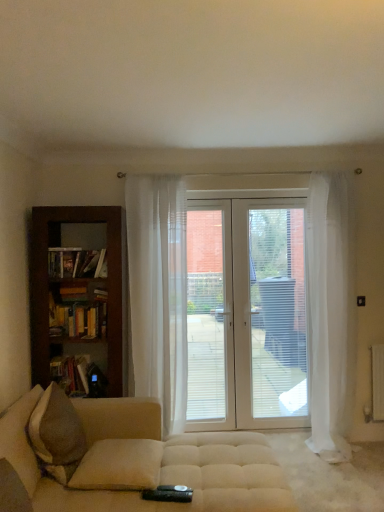
What do you see at coordinates (119, 465) in the screenshot?
I see `beige fabric pillow at lower center, the 2th pillow in the left-to-right sequence` at bounding box center [119, 465].

You are a GUI agent. You are given a task and a screenshot of the screen. Output one action in this format:
    pyautogui.click(x=<x>, y=<y>)
    Task: Click on the beige fabric pillow at lower left, which is the 1th pillow in front-to-back order
    The width and height of the screenshot is (384, 512).
    Given the screenshot: What is the action you would take?
    pyautogui.click(x=20, y=439)

This screenshot has height=512, width=384. What do you see at coordinates (158, 292) in the screenshot?
I see `sheer white curtain at center, the 2th curtain in the right-to-left sequence` at bounding box center [158, 292].

Describe the element at coordinates (78, 319) in the screenshot. I see `wooden bookshelf at left, acting as the second book starting from the bottom` at that location.

Image resolution: width=384 pixels, height=512 pixels. What are the coordinates of `white sheer curtain at right, positioned as the 1th curtain in right-to-left order` in the screenshot? It's located at click(x=330, y=313).

You are a GUI agent. You are given a task and a screenshot of the screen. Output one action in this format:
    pyautogui.click(x=<x>, y=<y>)
    Task: Click on the beige fabric studio couch at lower left
    
    Given the screenshot: What is the action you would take?
    pyautogui.click(x=137, y=463)

Find the location of a particular element. The height and width of the screenshot is (512, 384). beige fabric pillow at lower center, which is the 2th pillow from front to back is located at coordinates (119, 465).

Which object is wider, beige fabric studio couch at lower left or sheer white curtain at center, the 2th curtain in the right-to-left sequence?

beige fabric studio couch at lower left.

From the image's perspective, is beige fabric studio couch at lower left above or below sheer white curtain at center, which appears as the 1th curtain when viewed from the left?

beige fabric studio couch at lower left is below sheer white curtain at center, which appears as the 1th curtain when viewed from the left.

Are white sheer curtain at right, which appears as the 2th curtain when viewed from the left, and beige fabric studio couch at lower left far apart?

Yes, white sheer curtain at right, which appears as the 2th curtain when viewed from the left, is far from beige fabric studio couch at lower left.

Considering the positions of objects white sheer curtain at right, which appears as the 2th curtain when viewed from the left, and beige fabric studio couch at lower left in the image provided, who is in front, white sheer curtain at right, which appears as the 2th curtain when viewed from the left, or beige fabric studio couch at lower left?

beige fabric studio couch at lower left is closer to the camera.

From a real-world perspective, is white sheer curtain at right, which appears as the 2th curtain when viewed from the left, above or below beige fabric studio couch at lower left?

From a real-world perspective, white sheer curtain at right, which appears as the 2th curtain when viewed from the left, is physically above beige fabric studio couch at lower left.

Is the surface of beige fabric pillow at lower left, the 1th pillow from the left, in direct contact with wooden bookshelf at left, the 1th book viewed from the top?

No, beige fabric pillow at lower left, the 1th pillow from the left, is not with wooden bookshelf at left, the 1th book viewed from the top.

Which is behind, beige fabric pillow at lower left, which is the 1th pillow in front-to-back order, or wooden bookshelf at left, acting as the second book starting from the bottom?

wooden bookshelf at left, acting as the second book starting from the bottom.

Is beige fabric pillow at lower left, the 1th pillow from the left, shorter than wooden bookshelf at left, the 1th book viewed from the top?

In fact, beige fabric pillow at lower left, the 1th pillow from the left, may be taller than wooden bookshelf at left, the 1th book viewed from the top.

Which of these two, beige fabric pillow at lower left, the 2th pillow from the back, or wooden bookshelf at left, the 1th book viewed from the top, is thinner?

With smaller width is wooden bookshelf at left, the 1th book viewed from the top.

Is beige fabric pillow at lower left, the 2th pillow from the back, outside of beige fabric studio couch at lower left?

Absolutely, beige fabric pillow at lower left, the 2th pillow from the back, is external to beige fabric studio couch at lower left.

Based on the photo, is beige fabric pillow at lower left, the 1th pillow from the left, at the left side of beige fabric studio couch at lower left?

Yes, beige fabric pillow at lower left, the 1th pillow from the left, is to the left of beige fabric studio couch at lower left.

Which is behind, point (60, 213) or point (118, 484)?

Positioned behind is point (60, 213).

Is dark wood bookcase at left in contact with beige fabric pillow at lower center, arranged as the 1th pillow when viewed from the back?

No.

Considering the positions of objects dark wood bookcase at left and beige fabric pillow at lower center, the 2th pillow in the left-to-right sequence, in the image provided, who is more to the right, dark wood bookcase at left or beige fabric pillow at lower center, the 2th pillow in the left-to-right sequence,?

beige fabric pillow at lower center, the 2th pillow in the left-to-right sequence.

In terms of width, does dark wood bookcase at left look wider or thinner when compared to beige fabric pillow at lower center, which is the 1th pillow from right to left?

dark wood bookcase at left is thinner than beige fabric pillow at lower center, which is the 1th pillow from right to left.

How far apart are white glossy door at center and beige fabric pillow at lower left, which is the 1th pillow in front-to-back order?

They are 1.85 meters apart.

Considering the sizes of objects white glossy door at center and beige fabric pillow at lower left, which is the 1th pillow in front-to-back order, in the image provided, who is thinner, white glossy door at center or beige fabric pillow at lower left, which is the 1th pillow in front-to-back order,?

white glossy door at center.

Considering the sizes of objects white glossy door at center and beige fabric pillow at lower left, the second pillow positioned from the right, in the image provided, who is shorter, white glossy door at center or beige fabric pillow at lower left, the second pillow positioned from the right,?

With less height is beige fabric pillow at lower left, the second pillow positioned from the right.

From the image's perspective, is white glossy door at center positioned above or below beige fabric pillow at lower left, the 1th pillow from the left?

white glossy door at center is situated higher than beige fabric pillow at lower left, the 1th pillow from the left, in the image.

Who is smaller, beige fabric studio couch at lower left or hardcover book at left, the second book positioned from the top?

hardcover book at left, the second book positioned from the top, is smaller.

Measure the distance from beige fabric studio couch at lower left to hardcover book at left, the second book positioned from the top.

88.33 centimeters.

Between beige fabric studio couch at lower left and hardcover book at left, the second book positioned from the top, which one is positioned behind?

hardcover book at left, the second book positioned from the top, is further from the camera.

Considering the sizes of beige fabric studio couch at lower left and hardcover book at left, the second book positioned from the top, in the image, is beige fabric studio couch at lower left wider or thinner than hardcover book at left, the second book positioned from the top,?

Considering their sizes, beige fabric studio couch at lower left looks broader than hardcover book at left, the second book positioned from the top.

You are a GUI agent. You are given a task and a screenshot of the screen. Output one action in this format:
    pyautogui.click(x=<x>, y=<y>)
    Task: Click on the 2nd curtain behind the beige fabric studio couch at lower left
    
    Given the screenshot: What is the action you would take?
    coord(158,292)

This screenshot has width=384, height=512. I want to click on the 1st curtain above the beige fabric studio couch at lower left (from a real-world perspective), so click(330, 313).

Which object lies further to the anchor point beige fabric pillow at lower left, which is the 1th pillow in front-to-back order, hardcover book at left, the second book positioned from the top, or beige fabric studio couch at lower left?

Based on the image, hardcover book at left, the second book positioned from the top, appears to be further to beige fabric pillow at lower left, which is the 1th pillow in front-to-back order.

Looking at this image, estimate the real-world distances between objects in this image. Which object is closer to beige fabric studio couch at lower left, beige fabric pillow at lower left, the 1th pillow from the left, or white glossy door at center?

Based on the image, beige fabric pillow at lower left, the 1th pillow from the left, appears to be nearer to beige fabric studio couch at lower left.

From the picture: Which object lies nearer to the anchor point hardcover book at left, the second book positioned from the top, beige fabric studio couch at lower left or beige fabric pillow at lower left, the 2th pillow from the back?

beige fabric pillow at lower left, the 2th pillow from the back, is positioned closer to the anchor hardcover book at left, the second book positioned from the top.

When comparing their distances from beige fabric pillow at lower center, the 2th pillow in the left-to-right sequence, does white sheer curtain at right, which appears as the 2th curtain when viewed from the left, or hardcover book at left, the second book positioned from the top, seem closer?

hardcover book at left, the second book positioned from the top, lies closer to beige fabric pillow at lower center, the 2th pillow in the left-to-right sequence, than the other object.

Estimate the real-world distances between objects in this image. Which object is closer to white glossy door at center, dark wood bookcase at left or beige fabric studio couch at lower left?

Based on the image, dark wood bookcase at left appears to be nearer to white glossy door at center.

Based on the photo, considering their positions, is beige fabric pillow at lower left, the 1th pillow from the left, positioned closer to beige fabric pillow at lower center, which is the 1th pillow from right to left, than sheer white curtain at center, which appears as the 1th curtain when viewed from the left?

beige fabric pillow at lower left, the 1th pillow from the left, is positioned closer to the anchor beige fabric pillow at lower center, which is the 1th pillow from right to left.

Based on their spatial positions, is dark wood bookcase at left or hardcover book at left, which is counted as the first book, starting from the bottom, closer to beige fabric pillow at lower left, the 2th pillow from the back?

The object closer to beige fabric pillow at lower left, the 2th pillow from the back, is hardcover book at left, which is counted as the first book, starting from the bottom.

Estimate the real-world distances between objects in this image. Which object is further from wooden bookshelf at left, acting as the second book starting from the bottom, sheer white curtain at center, the 2th curtain in the right-to-left sequence, or beige fabric pillow at lower center, which is the 2th pillow from front to back?

Among the two, beige fabric pillow at lower center, which is the 2th pillow from front to back, is located further to wooden bookshelf at left, acting as the second book starting from the bottom.

Identify the location of bookcase located between beige fabric pillow at lower left, the 2th pillow from the back, and white glossy door at center in the depth direction. The image size is (384, 512). (48, 284).

Where is `studio couch between dark wood bookcase at left and white sheer curtain at right, positioned as the 1th curtain in right-to-left order`? Image resolution: width=384 pixels, height=512 pixels. studio couch between dark wood bookcase at left and white sheer curtain at right, positioned as the 1th curtain in right-to-left order is located at coordinates (137, 463).

In order to click on book between hardcover book at left, the second book positioned from the top, and sheer white curtain at center, which appears as the 1th curtain when viewed from the left in this screenshot , I will do `click(78, 319)`.

Locate an element on the screen. The image size is (384, 512). pillow between beige fabric studio couch at lower left and wooden bookshelf at left, acting as the second book starting from the bottom, along the z-axis is located at coordinates (119, 465).